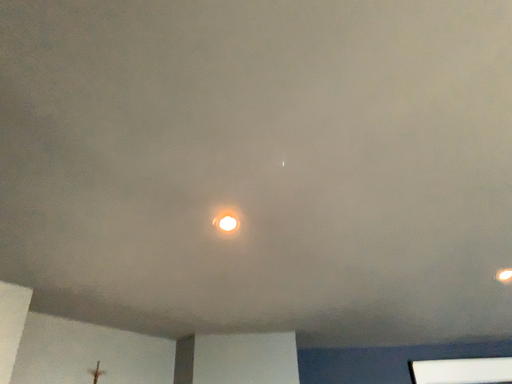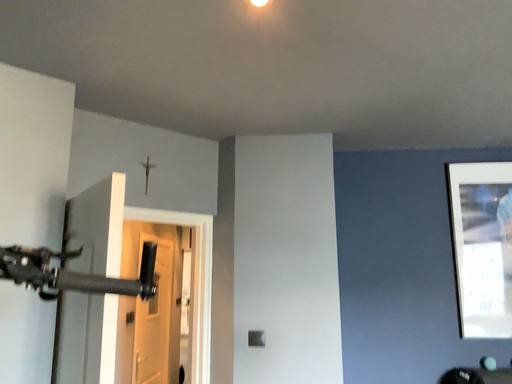
Question: How did the camera likely rotate when shooting the video?

Choices:
 (A) rotated downward
 (B) rotated upward

Answer: (A)